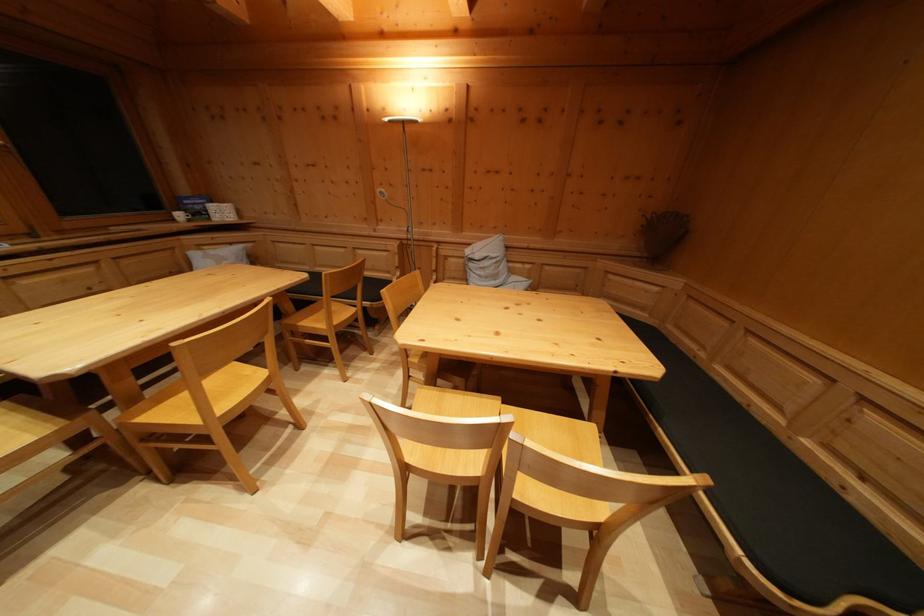
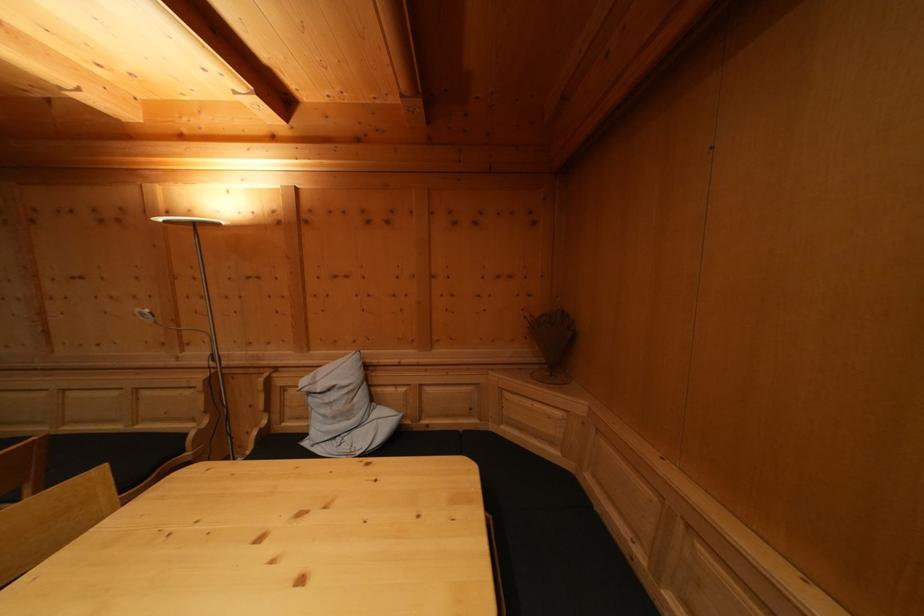
Question: The first image is from the beginning of the video and the second image is from the end. How did the camera likely rotate when shooting the video?

Choices:
 (A) Left
 (B) Right
 (C) Up
 (D) Down

Answer: (C)